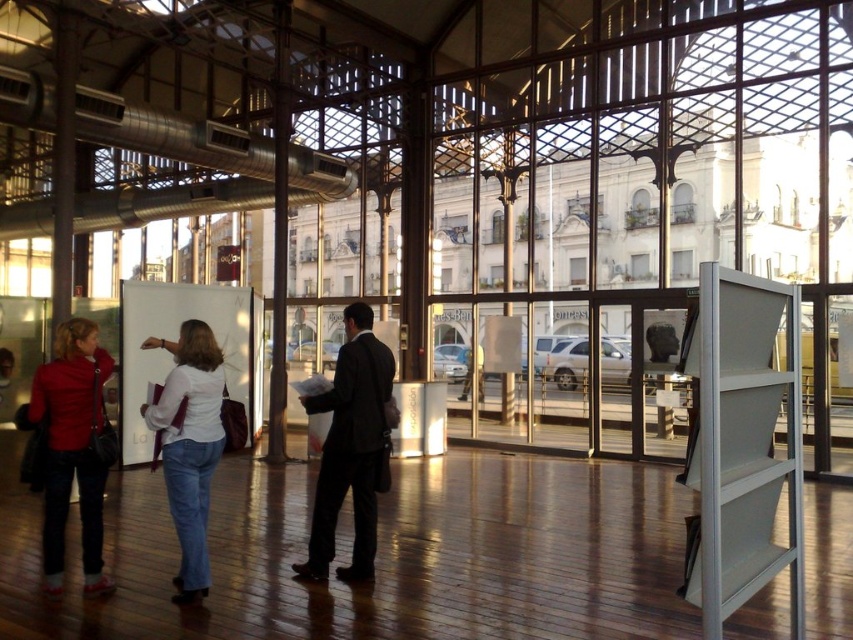
You are a delivery person carrying a package that is 24 inches long. You need to navigate through the space between the matte red jacket at left and the white matte shirt at center. Can you pass through without tilting the package?

The distance between the matte red jacket at left and the white matte shirt at center is 22.34 inches, which is shorter than the 24 inch package. Therefore, you cannot pass through without tilting or repositioning the package.

You are a security guard in this modern indoor space. You need to check if two visitors, one wearing a dark suit at center and another in a matte red jacket at left, are within the 2 meters social distancing guideline. Are they compliant?

The distance between the dark suit at center and the matte red jacket at left is 1.58 meters, which is below the 2 meters social distancing guideline. Therefore, they are not compliant.

You are a store manager organizing a clothing display. You have a matte red jacket at left and a white matte shirt at center. Which clothing item requires a wider shelf space for proper display?

The white matte shirt at center requires wider shelf space because its width is greater than the matte red jacket at left.